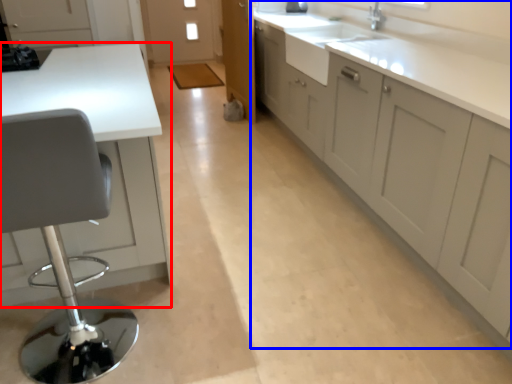
Question: Which object appears closest to the camera in this image, countertop (highlighted by a red box) or cabinetry (highlighted by a blue box)?

Choices:
 (A) countertop
 (B) cabinetry

Answer: (B)